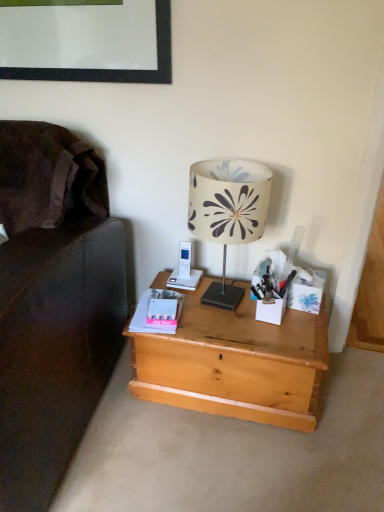
Find the location of a particular element. The image size is (384, 512). free space in front of natural wood desk at center is located at coordinates (236, 462).